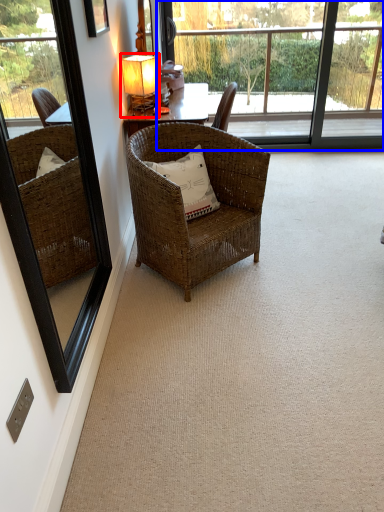
Question: Which object is further to the camera taking this photo, table lamp (highlighted by a red box) or bay window (highlighted by a blue box)?

Choices:
 (A) table lamp
 (B) bay window

Answer: (B)